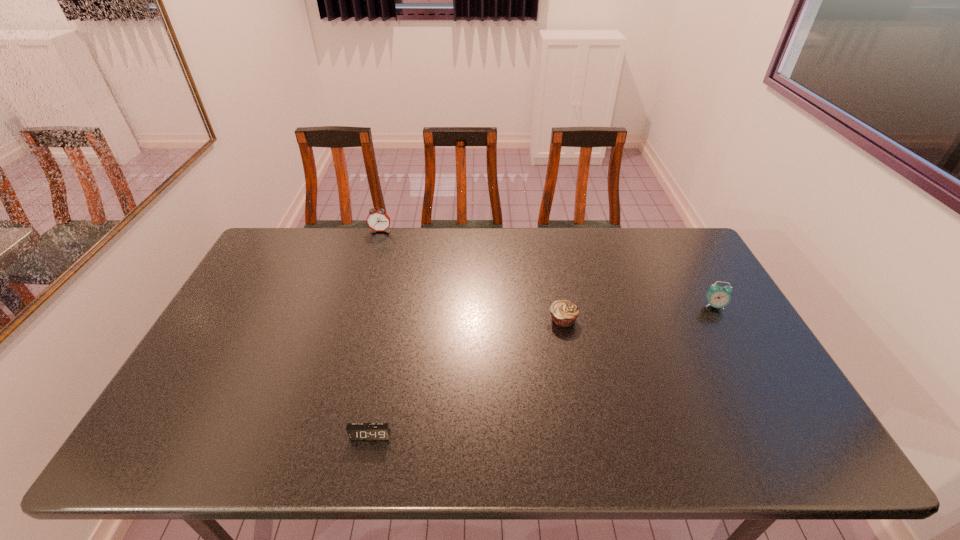
Find the location of a particular element. The image size is (960, 540). free space at the near right corner of the desktop is located at coordinates (758, 442).

Locate an element on the screen. Image resolution: width=960 pixels, height=540 pixels. free space between the third object from left to right and the leftmost alarm clock is located at coordinates (471, 275).

In order to click on vacant area that lies between the leftmost alarm clock and the nearest alarm clock in this screenshot , I will do `click(375, 333)`.

Find the location of a particular element. free space that is in between the second object from right to left and the shortest object is located at coordinates [x=467, y=377].

Locate an element on the screen. free space that is in between the nearest alarm clock and the rightmost alarm clock is located at coordinates [x=542, y=370].

Image resolution: width=960 pixels, height=540 pixels. Find the location of `free area in between the rightmost alarm clock and the leftmost object`. free area in between the rightmost alarm clock and the leftmost object is located at coordinates [547, 268].

At what (x,y) coordinates should I click in order to perform the action: click on vacant space that is in between the leftmost object and the muffin. Please return your answer as a coordinate pair (x, y). The width and height of the screenshot is (960, 540). Looking at the image, I should click on (471, 275).

Identify the location of vacant region between the second nearest alarm clock and the second alarm clock from left to right. The image size is (960, 540). [x=542, y=370].

This screenshot has height=540, width=960. Find the location of `unoccupied position between the farthest alarm clock and the third object from left to right`. unoccupied position between the farthest alarm clock and the third object from left to right is located at coordinates (471, 275).

At what (x,y) coordinates should I click in order to perform the action: click on vacant region between the third object from right to left and the second nearest alarm clock. Please return your answer as a coordinate pair (x, y). The width and height of the screenshot is (960, 540). Looking at the image, I should click on (542, 370).